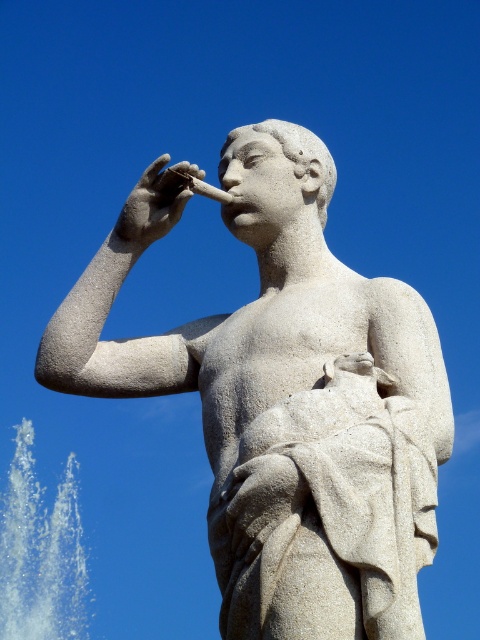
Question: Can you confirm if white stone statue at center is smaller than white stone hand at upper center?

Choices:
 (A) no
 (B) yes

Answer: (A)

Question: Which point is closer to the camera?

Choices:
 (A) (15, 536)
 (B) (124, 220)

Answer: (B)

Question: Which object is farther from the camera taking this photo?

Choices:
 (A) white vapor at lower left
 (B) white stone statue at center

Answer: (A)

Question: Can you confirm if white stone statue at center is positioned to the left of white stone hand at upper center?

Choices:
 (A) yes
 (B) no

Answer: (B)

Question: Among these objects, which one is farthest from the camera?

Choices:
 (A) white stone statue at center
 (B) white vapor at lower left

Answer: (B)

Question: Is white stone statue at center smaller than white stone hand at upper center?

Choices:
 (A) yes
 (B) no

Answer: (B)